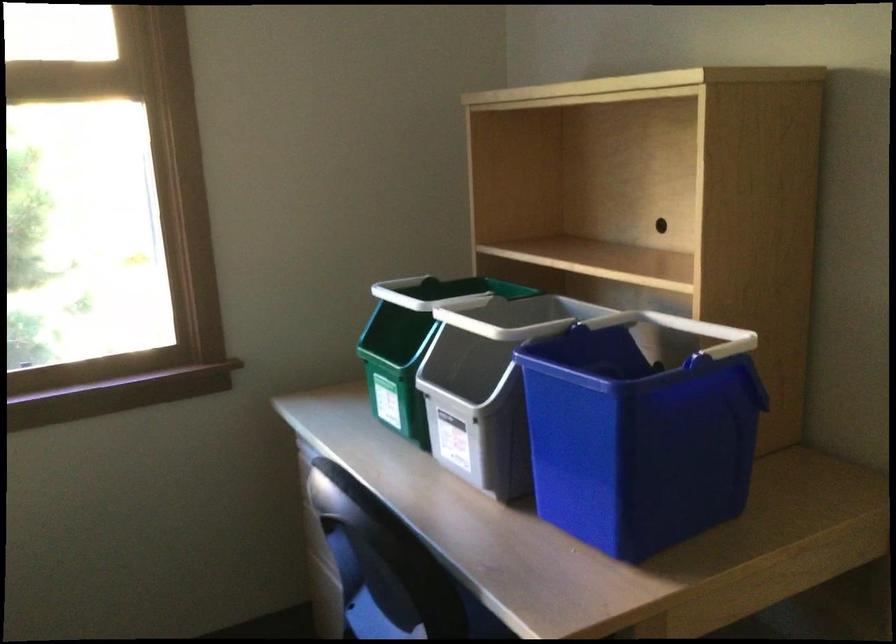
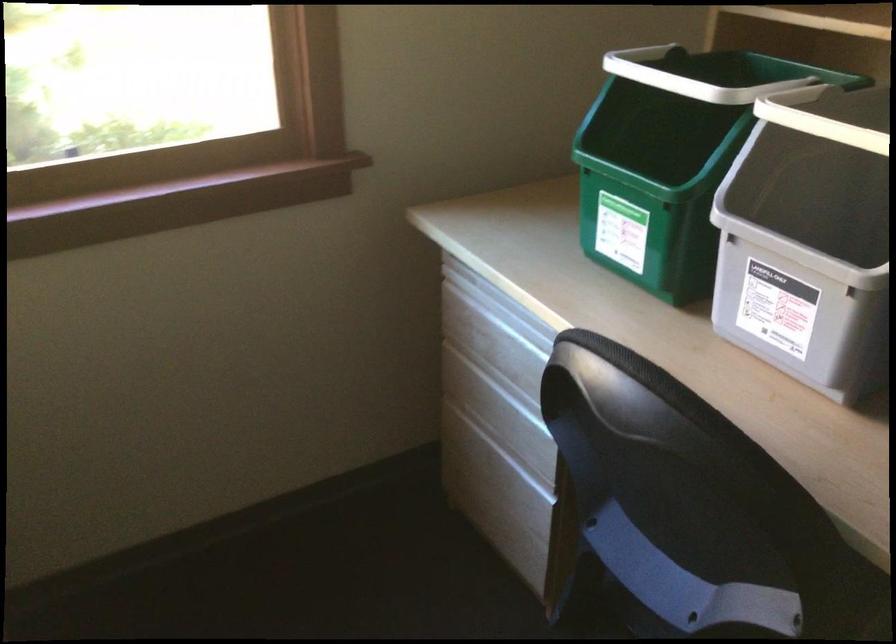
Find the pixel in the second image that matches pixel 392 374 in the first image.

(652, 194)